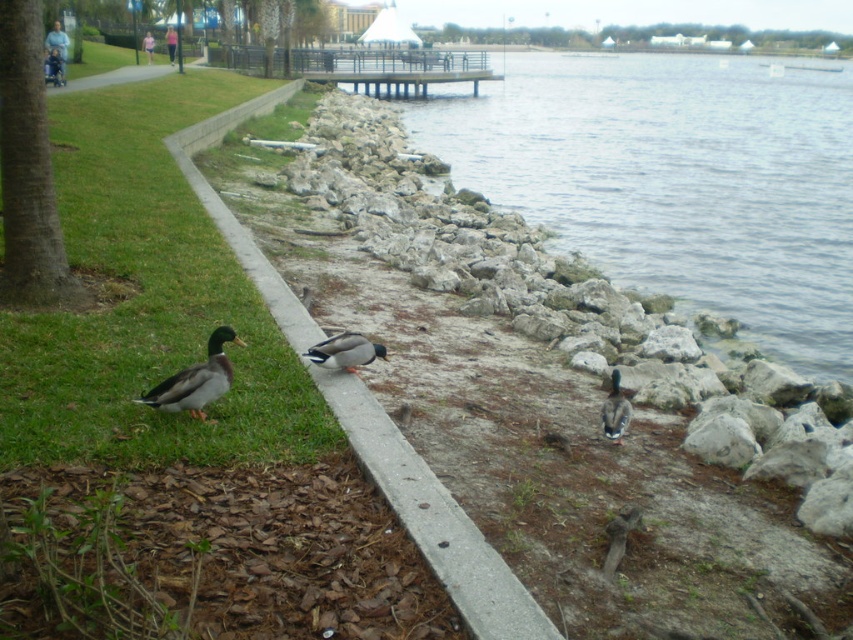
You are standing at the origin point of the image. Where is the green grass at lower left located?

The green grass at lower left is located at point (148, 300).

You are a photographer trying to capture both the green glossy duck at lower left and the green glossy duck at center in a single shot. Based on their positions, which duck is positioned closer to the left edge of the image?

The green glossy duck at lower left is positioned closer to the left edge of the image compared to the green glossy duck at center.